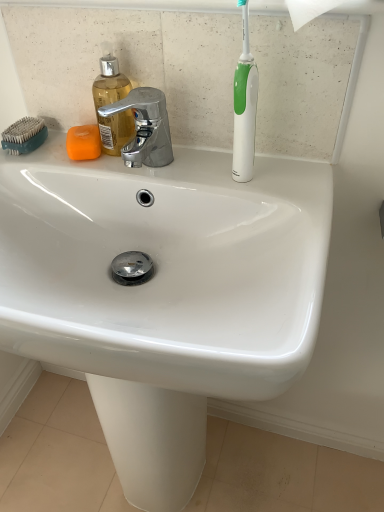
Question: Looking at the image, does teal plastic comb at upper left seem bigger or smaller compared to polished chrome faucet at upper center?

Choices:
 (A) small
 (B) big

Answer: (A)

Question: Is point (33, 150) positioned closer to the camera than point (150, 156)?

Choices:
 (A) farther
 (B) closer

Answer: (A)

Question: Which object is positioned farthest from the white glossy sink at center?

Choices:
 (A) translucent plastic soap dispenser at upper left
 (B) orange matte soap at upper left
 (C) teal plastic comb at upper left
 (D) white glossy toothbrush at upper right
 (E) polished chrome faucet at upper center

Answer: (C)

Question: Considering the real-world distances, which object is farthest from the orange matte soap at upper left?

Choices:
 (A) white glossy toothbrush at upper right
 (B) translucent plastic soap dispenser at upper left
 (C) white glossy sink at center
 (D) polished chrome faucet at upper center
 (E) teal plastic comb at upper left

Answer: (C)